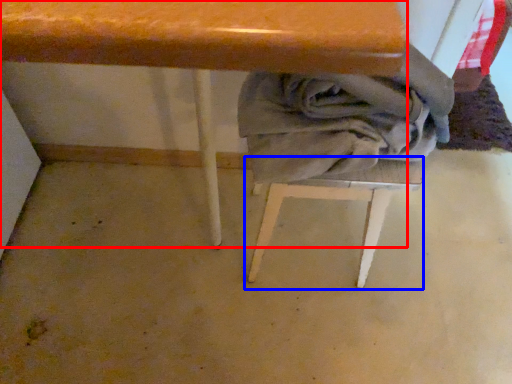
Question: Which object appears closest to the camera in this image, table (highlighted by a red box) or step stool (highlighted by a blue box)?

Choices:
 (A) table
 (B) step stool

Answer: (A)